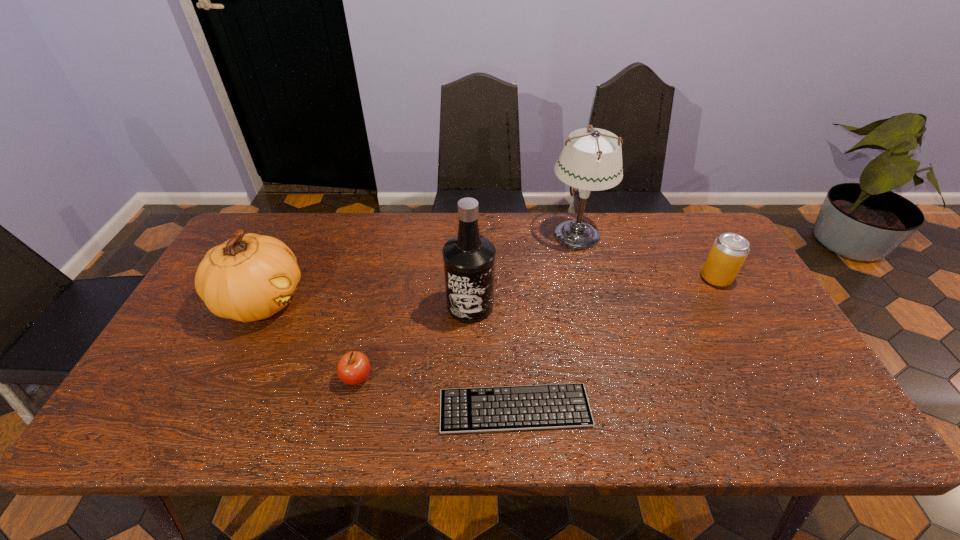
Identify the location of lampshade. (592, 161).

You are a GUI agent. You are given a task and a screenshot of the screen. Output one action in this format:
    pyautogui.click(x=<x>, y=<y>)
    Task: Click on the liquor
    This screenshot has height=540, width=960.
    Given the screenshot: What is the action you would take?
    pyautogui.click(x=469, y=259)

You are a GUI agent. You are given a task and a screenshot of the screen. Output one action in this format:
    pyautogui.click(x=<x>, y=<y>)
    Task: Click on the leftmost object
    The width and height of the screenshot is (960, 540).
    Given the screenshot: What is the action you would take?
    click(250, 277)

Find the location of `the fourth shortest object`. the fourth shortest object is located at coordinates (250, 277).

This screenshot has width=960, height=540. In order to click on pop (soda) in this screenshot , I will do `click(729, 251)`.

Locate an element on the screen. The image size is (960, 540). the fourth tallest object is located at coordinates (729, 251).

This screenshot has width=960, height=540. I want to click on the second object from left to right, so click(353, 368).

The width and height of the screenshot is (960, 540). I want to click on apple, so click(353, 368).

At what (x,y) coordinates should I click in order to perform the action: click on the shortest object. Please return your answer as a coordinate pair (x, y). Looking at the image, I should click on (505, 408).

The height and width of the screenshot is (540, 960). Find the location of `vacant region located on the lampshade of the lampshade`. vacant region located on the lampshade of the lampshade is located at coordinates (449, 234).